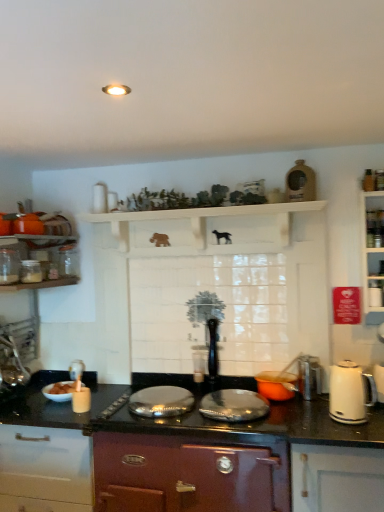
The width and height of the screenshot is (384, 512). Identify the location of black granite countertop at center. (185, 459).

At what (x,y) coordinates should I click in order to perform the action: click on white wooden shelf at upper center. Please return your answer as a coordinate pair (x, y). Looking at the image, I should click on (200, 229).

Does white glossy jar at upper left appear on the left side of clear glass jar at left, positioned as the fourth kitchen appliance in right-to-left order?

No.

I want to click on appliance that appears below the clear glass jar at left, the first kitchen appliance positioned from the top (from a real-world perspective), so click(76, 370).

Considering the sizes of objects white glossy jar at upper left and clear glass jar at left, acting as the 4th kitchen appliance starting from the bottom, in the image provided, who is bigger, white glossy jar at upper left or clear glass jar at left, acting as the 4th kitchen appliance starting from the bottom,?

Bigger between the two is clear glass jar at left, acting as the 4th kitchen appliance starting from the bottom.

Considering the sizes of objects white wooden shelf at upper center and clear glass jar at left, the first kitchen appliance positioned from the top, in the image provided, who is wider, white wooden shelf at upper center or clear glass jar at left, the first kitchen appliance positioned from the top,?

With larger width is white wooden shelf at upper center.

Which of these two, white wooden shelf at upper center or clear glass jar at left, which is the 1th kitchen appliance in left-to-right order, is bigger?

white wooden shelf at upper center is bigger.

Measure the distance between white wooden shelf at upper center and clear glass jar at left, positioned as the fourth kitchen appliance in right-to-left order.

white wooden shelf at upper center and clear glass jar at left, positioned as the fourth kitchen appliance in right-to-left order, are 33.63 inches apart from each other.

Is white wooden shelf at upper center oriented towards clear glass jar at left, positioned as the fourth kitchen appliance in right-to-left order?

No, white wooden shelf at upper center is not oriented towards clear glass jar at left, positioned as the fourth kitchen appliance in right-to-left order.

Locate an element on the screen. The image size is (384, 512). appliance that is on the left side of white glossy kettle at right, which is the fourth kitchen appliance from left to right is located at coordinates (76, 370).

Are white glossy jar at upper left and white glossy kettle at right, which ranks as the third kitchen appliance in top-to-bottom order, located far from each other?

Yes, white glossy jar at upper left and white glossy kettle at right, which ranks as the third kitchen appliance in top-to-bottom order, are quite far apart.

From a real-world perspective, between white glossy jar at upper left and white glossy kettle at right, which ranks as the third kitchen appliance in top-to-bottom order, who is vertically lower?

white glossy jar at upper left is physically lower.

Between white glossy jar at upper left and white glossy kettle at right, which is counted as the second kitchen appliance, starting from the bottom, which one appears on the left side from the viewer's perspective?

Positioned to the left is white glossy jar at upper left.

Does white glossy kettle at right, which ranks as the third kitchen appliance in top-to-bottom order, contain white glossy bowl at lower left?

No, white glossy bowl at lower left is not surrounded by white glossy kettle at right, which ranks as the third kitchen appliance in top-to-bottom order.

From a real-world perspective, is white glossy kettle at right, placed as the first kitchen appliance when sorted from right to left, under white glossy bowl at lower left?

No, from a real-world perspective, white glossy kettle at right, placed as the first kitchen appliance when sorted from right to left, is not under white glossy bowl at lower left.

Which of these two, white glossy kettle at right, which is the fourth kitchen appliance from left to right, or white glossy bowl at lower left, stands taller?

white glossy kettle at right, which is the fourth kitchen appliance from left to right, is taller.

Is the surface of white glossy kettle at right, which is the fourth kitchen appliance from left to right, in direct contact with white glossy bowl at lower left?

They are not placed beside each other.

Is black granite countertop at center aimed at white glossy jar at upper left?

No, black granite countertop at center does not turn towards white glossy jar at upper left.

Would you say black granite countertop at center is to the left or to the right of white glossy jar at upper left in the picture?

Based on their positions, black granite countertop at center is located to the right of white glossy jar at upper left.

Considering the sizes of objects black granite countertop at center and white glossy jar at upper left in the image provided, who is bigger, black granite countertop at center or white glossy jar at upper left?

With larger size is black granite countertop at center.

Which object is wider, black granite countertop at center or white glossy jar at upper left?

black granite countertop at center is wider.

From a real-world perspective, relative to black granite countertop at center, is white glossy bowl at lower left vertically above or below?

Clearly, from a real-world perspective, white glossy bowl at lower left is above black granite countertop at center.

Considering the sizes of objects white glossy bowl at lower left and black granite countertop at center in the image provided, who is thinner, white glossy bowl at lower left or black granite countertop at center?

white glossy bowl at lower left is thinner.

How much distance is there between white glossy bowl at lower left and black granite countertop at center?

19.94 inches.

Considering the relative positions of white glossy bowl at lower left and black granite countertop at center in the image provided, is white glossy bowl at lower left to the left of black granite countertop at center from the viewer's perspective?

Yes.

What's the angular difference between white wooden shelf at upper center and white glossy bowl at lower left's facing directions?

2.72 degrees separate the facing orientations of white wooden shelf at upper center and white glossy bowl at lower left.

Is white wooden shelf at upper center bigger than white glossy bowl at lower left?

Yes.

At what (x,y) coordinates should I click in order to perform the action: click on sink lying behind the white wooden shelf at upper center. Please return your answer as a coordinate pair (x, y). Image resolution: width=384 pixels, height=512 pixels. Looking at the image, I should click on (66, 384).

Is point (190, 228) farther from viewer compared to point (74, 382)?

Yes, it is behind point (74, 382).

Locate an element on the screen. This screenshot has width=384, height=512. appliance behind the clear glass jar at left, the first kitchen appliance positioned from the top is located at coordinates (76, 370).

Locate an element on the screen. kitchen appliance that is the 1st object directly below the white wooden shelf at upper center (from a real-world perspective) is located at coordinates (9, 266).

Looking at the image, which one is located closer to clear glass jar at left, acting as the 4th kitchen appliance starting from the bottom, white glossy jar at upper left or clear glass jar at left, the 2th kitchen appliance positioned from the left?

clear glass jar at left, the 2th kitchen appliance positioned from the left, lies closer to clear glass jar at left, acting as the 4th kitchen appliance starting from the bottom, than the other object.

Estimate the real-world distances between objects in this image. Which object is closer to white glossy jar at upper left, black granite countertop at center or white wooden shelf at upper center?

black granite countertop at center lies closer to white glossy jar at upper left than the other object.

Looking at the image, which one is located further to white glossy bowl at lower left, white wooden shelf at upper center or clear glass jar at left, which is the third kitchen appliance in right-to-left order?

white wooden shelf at upper center lies further to white glossy bowl at lower left than the other object.

Consider the image. Based on their spatial positions, is white wooden shelf at upper center or white glossy jar at upper left closer to white glossy bowl at lower left?

The object closer to white glossy bowl at lower left is white glossy jar at upper left.

Estimate the real-world distances between objects in this image. Which object is closer to white glossy kettle at right, which is the fourth kitchen appliance from left to right, clear glass jar at left, acting as the 4th kitchen appliance starting from the bottom, or black granite countertop at center?

Based on the image, black granite countertop at center appears to be nearer to white glossy kettle at right, which is the fourth kitchen appliance from left to right.

Looking at the image, which one is located further to white glossy kettle at right, which ranks as the third kitchen appliance in top-to-bottom order, clear glass jar at left, positioned as the fourth kitchen appliance in right-to-left order, or white wooden shelf at upper center?

clear glass jar at left, positioned as the fourth kitchen appliance in right-to-left order, is further to white glossy kettle at right, which ranks as the third kitchen appliance in top-to-bottom order.

Estimate the real-world distances between objects in this image. Which object is further from clear glass jar at left, acting as the 4th kitchen appliance starting from the bottom, orange matte pot at center, marked as the third kitchen appliance in a left-to-right arrangement, or black granite countertop at center?

orange matte pot at center, marked as the third kitchen appliance in a left-to-right arrangement.

Which object lies nearer to the anchor point white wooden shelf at upper center, clear glass jar at left, which is the second kitchen appliance in top-to-bottom order, or black granite countertop at center?

clear glass jar at left, which is the second kitchen appliance in top-to-bottom order, is closer to white wooden shelf at upper center.

At what (x,y) coordinates should I click in order to perform the action: click on kitchen appliance between clear glass jar at left, acting as the 4th kitchen appliance starting from the bottom, and orange matte pot at center, positioned as the fourth kitchen appliance in top-to-bottom order, in the horizontal direction. Please return your answer as a coordinate pair (x, y). The width and height of the screenshot is (384, 512). Looking at the image, I should click on (31, 271).

Locate an element on the screen. This screenshot has height=512, width=384. countertop located between white glossy bowl at lower left and white glossy kettle at right, which is the fourth kitchen appliance from left to right, in the left-right direction is located at coordinates (185, 459).

The width and height of the screenshot is (384, 512). Find the location of `shelf between white glossy bowl at lower left and orange matte pot at center, marked as the third kitchen appliance in a left-to-right arrangement, from left to right`. shelf between white glossy bowl at lower left and orange matte pot at center, marked as the third kitchen appliance in a left-to-right arrangement, from left to right is located at coordinates (200, 229).

Where is `shelf between clear glass jar at left, which is the 1th kitchen appliance in left-to-right order, and orange matte pot at center, placed as the 1th kitchen appliance when sorted from bottom to top`? The image size is (384, 512). shelf between clear glass jar at left, which is the 1th kitchen appliance in left-to-right order, and orange matte pot at center, placed as the 1th kitchen appliance when sorted from bottom to top is located at coordinates (200, 229).